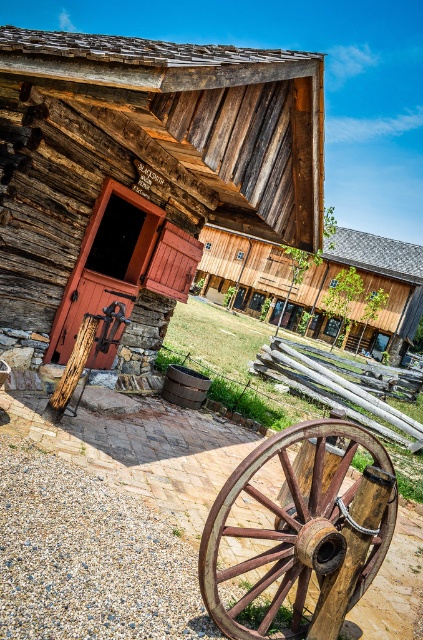
Consider the image. You are standing in front of the blacksmith shop and see the rustic wood barn at center and the rustic wood wagon wheel at center. Which object is positioned to the left of the other?

The rustic wood barn at center is to the left of rustic wood wagon wheel at center.